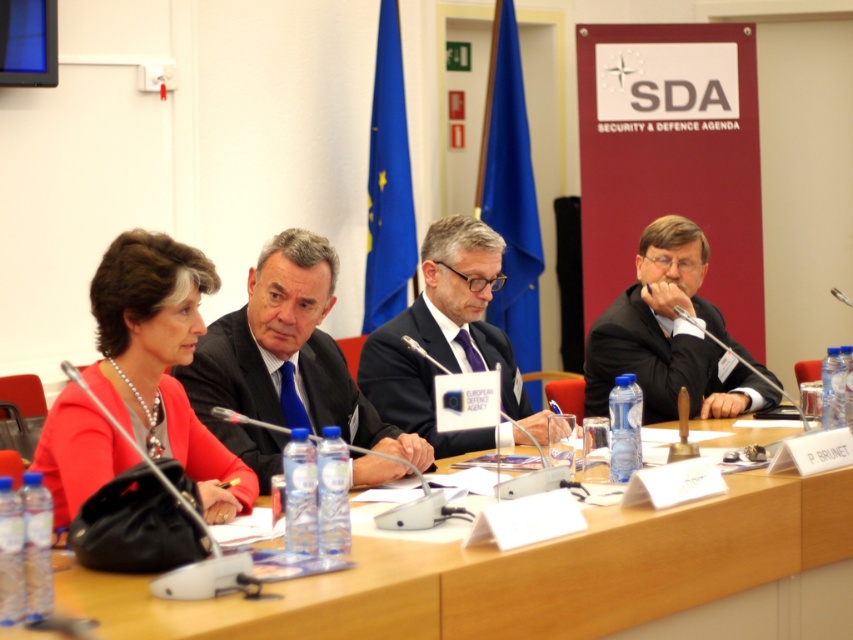
You are attending a virtual meeting and need to identify the position of the dark blue suit at center. What are its coordinates?

The dark blue suit at center is located at point [285,362].

You are organizing a photo shoot for a fashion magazine and need to arrange two models wearing the dark blue suit at center and dark gray suit at center. The requirement is that the smaller suit should be placed closer to the camera. Based on the scene description, which model should you position closer to the camera?

The dark blue suit at center is smaller than the dark gray suit at center, so the model wearing the dark blue suit at center should be positioned closer to the camera to meet the requirement.